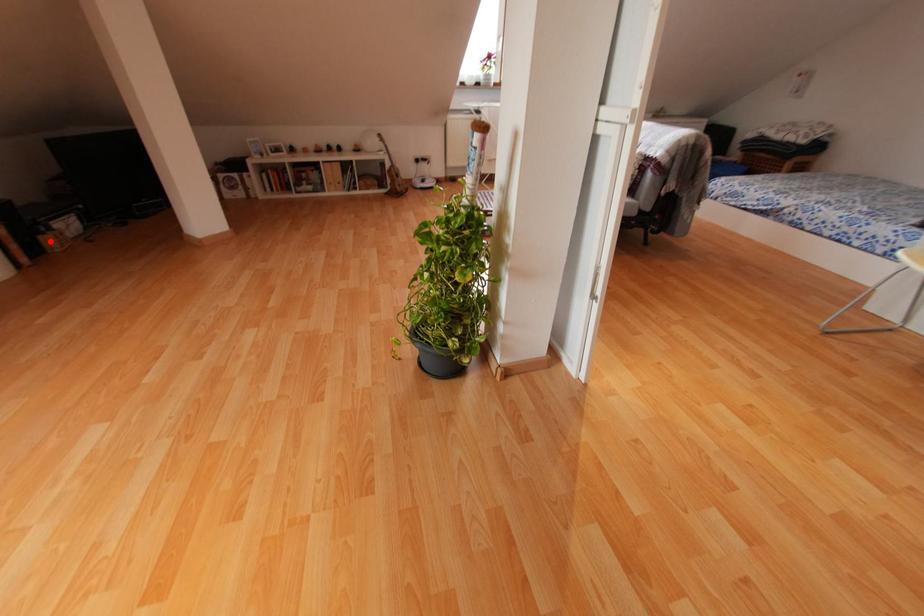
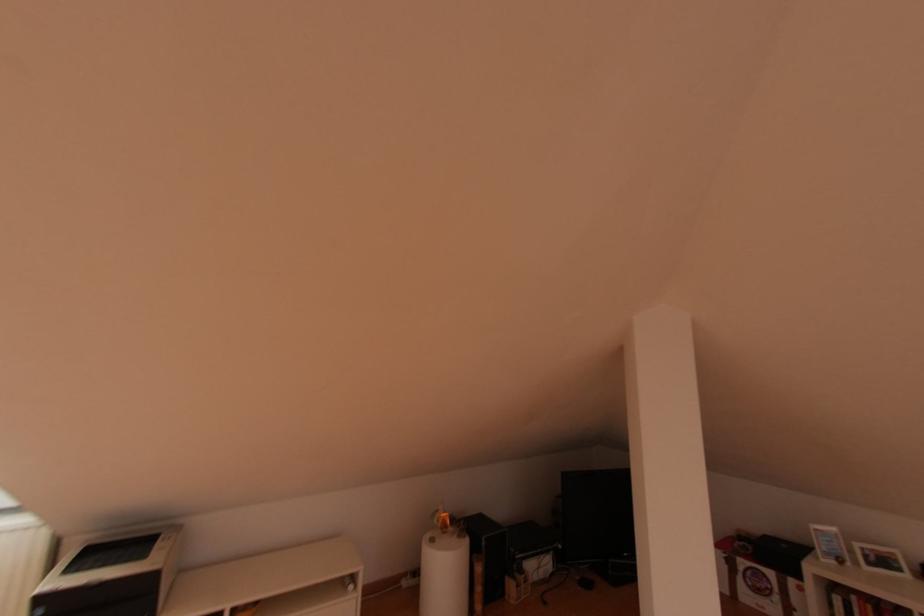
Question: I am providing you with two images of the same scene from different viewpoints. A red point is shown in image1. For the corresponding object point in image2, is it positioned nearer or farther from the camera?

Choices:
 (A) Nearer
 (B) Farther

Answer: (A)